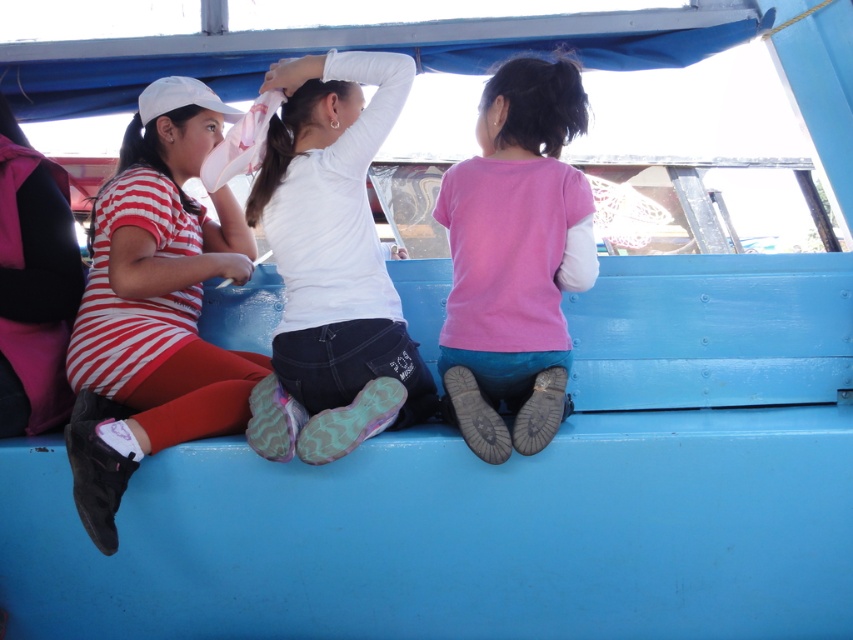
You are a photographer trying to capture a group photo of the striped fabric dress at left and the pink matte shirt at center. Since you want to ensure both subjects are clearly visible, which one should you focus on first considering their sizes?

The striped fabric dress at left is wider than the pink matte shirt at center, so you should focus on the striped fabric dress at left first to ensure it fits within the frame.

You are standing at the point marked by coordinates point (354, 198) and want to greet someone across the boat. If the person you want to greet is standing 2.28 meters away from you, are they likely in front of you or behind you?

The person you want to greet is likely in front of you since the distance between you and the viewer is 2.28 meters, implying the viewer is facing away from the point.